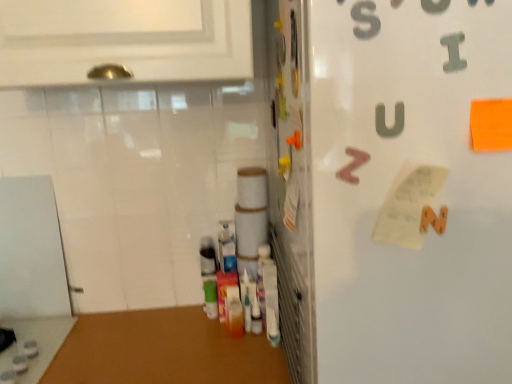
Question: Can you confirm if metallic silver door at center is positioned to the right of white paper at center-right?

Choices:
 (A) yes
 (B) no

Answer: (B)

Question: Is metallic silver door at center not inside white paper at center-right?

Choices:
 (A) yes
 (B) no

Answer: (A)

Question: Does metallic silver door at center have a lesser width compared to white paper at center-right?

Choices:
 (A) yes
 (B) no

Answer: (A)

Question: Is metallic silver door at center at the left side of white paper at center-right?

Choices:
 (A) no
 (B) yes

Answer: (B)

Question: Is metallic silver door at center in contact with white paper at center-right?

Choices:
 (A) no
 (B) yes

Answer: (A)

Question: Can you confirm if metallic silver door at center is shorter than white paper at center-right?

Choices:
 (A) yes
 (B) no

Answer: (B)

Question: Is metallic silver door at center thinner than metallic gray letter i at upper right, the 2th alphabet when ordered from bottom to top?

Choices:
 (A) no
 (B) yes

Answer: (A)

Question: From the image's perspective, is metallic silver door at center under metallic gray letter i at upper right, acting as the 2th alphabet starting from the back?

Choices:
 (A) no
 (B) yes

Answer: (B)

Question: Can you confirm if metallic silver door at center is shorter than metallic gray letter i at upper right, arranged as the second alphabet when viewed from the left?

Choices:
 (A) no
 (B) yes

Answer: (A)

Question: Can you confirm if metallic silver door at center is taller than metallic gray letter i at upper right, the first alphabet in the top-to-bottom sequence?

Choices:
 (A) yes
 (B) no

Answer: (A)

Question: Is metallic silver door at center positioned with its back to metallic gray letter i at upper right, acting as the 2th alphabet starting from the back?

Choices:
 (A) yes
 (B) no

Answer: (A)

Question: Are metallic silver door at center and metallic gray letter i at upper right, the first alphabet positioned from the front, located far from each other?

Choices:
 (A) no
 (B) yes

Answer: (A)

Question: From the image's perspective, is metallic gray letter i at upper right, the 2th alphabet when ordered from bottom to top, under brown matte letter z at upper right, the first alphabet viewed from the left?

Choices:
 (A) yes
 (B) no

Answer: (B)